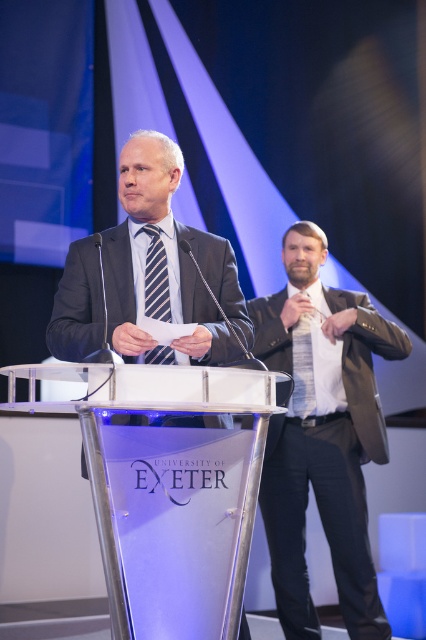
You are attending a conference at the University of Exeter and notice two items in the scene. The transparent acrylic podium at center and the matte black tie at right. Which item is positioned closer to you as you look at the image?

The transparent acrylic podium at center is closer to the viewer than the matte black tie at right.

You are organizing a presentation at the University of Exeter and need to place a name tag on the podium. The name tag must be placed either on the dark brown leather jacket at right or the striped fabric tie at center. Which object should you choose to ensure the name tag is visible to the audience?

The dark brown leather jacket at right is larger in size than the striped fabric tie at center, so placing the name tag on the dark brown leather jacket at right would ensure better visibility to the audience.